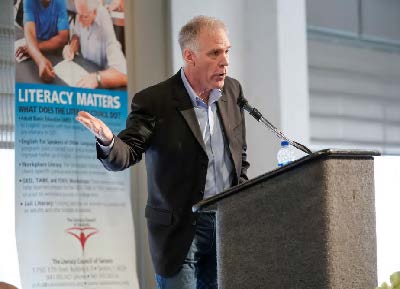
Locate an element on the screen. The width and height of the screenshot is (400, 289). lectern is located at coordinates (311, 225).